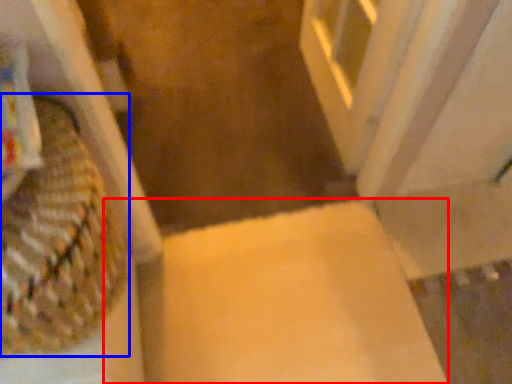
Question: Which object appears farthest to the camera in this image, cardboard box (highlighted by a red box) or basket (highlighted by a blue box)?

Choices:
 (A) cardboard box
 (B) basket

Answer: (A)